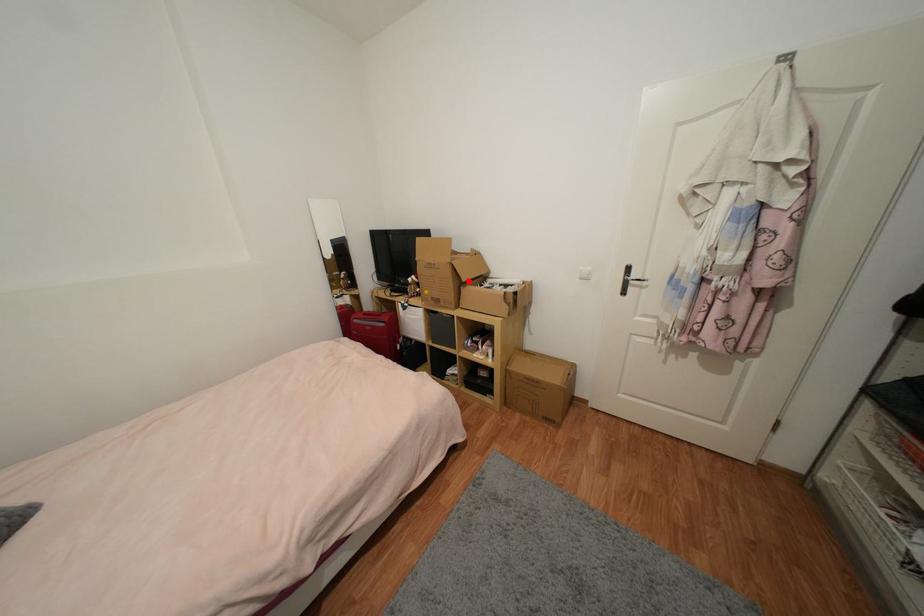
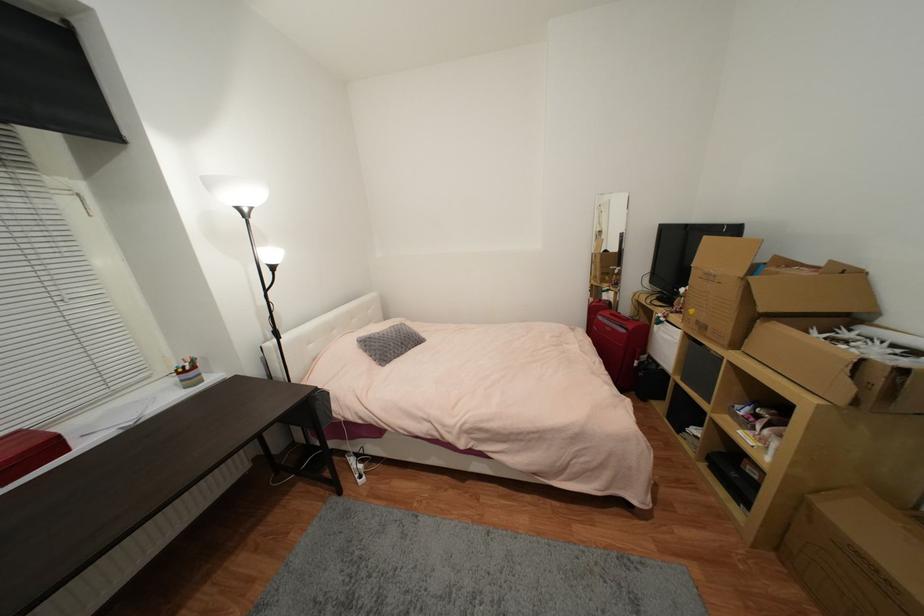
The point at the highlighted location is marked in the first image. Where is the corresponding point in the second image?

(767, 310)